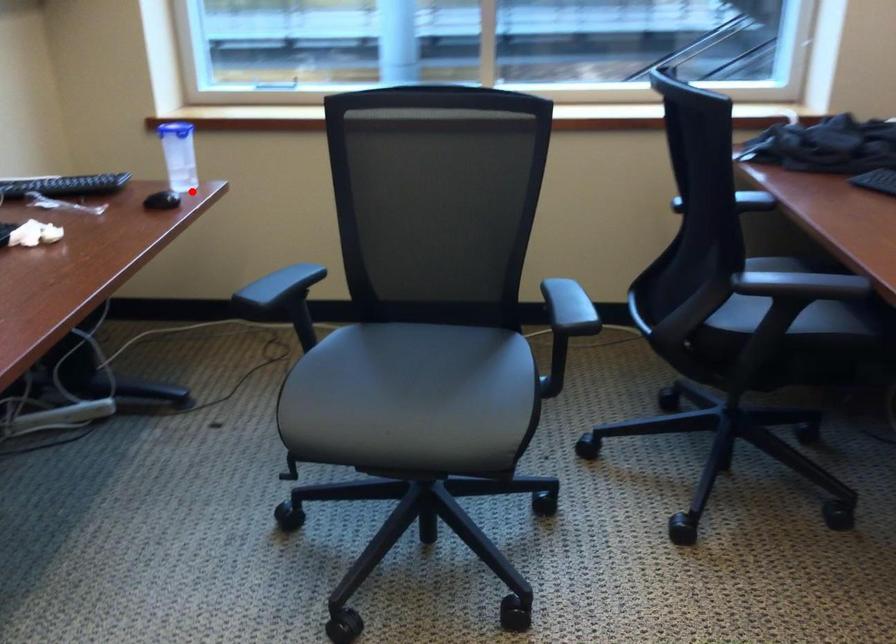
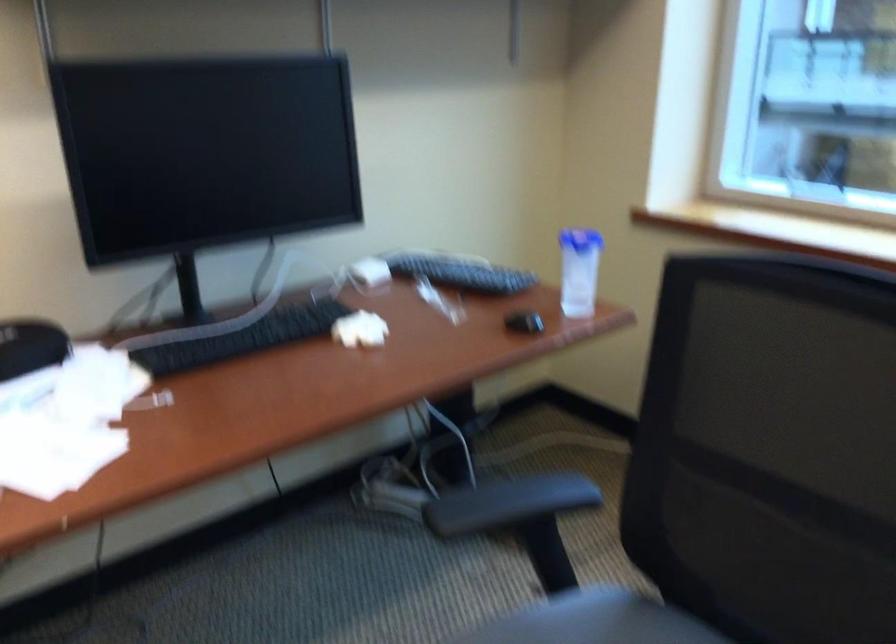
Question: I am providing you with two images of the same scene from different viewpoints. Given a red point in image1, look at the same physical point in image2. Is it:

Choices:
 (A) Closer to the viewpoint
 (B) Farther from the viewpoint

Answer: (A)